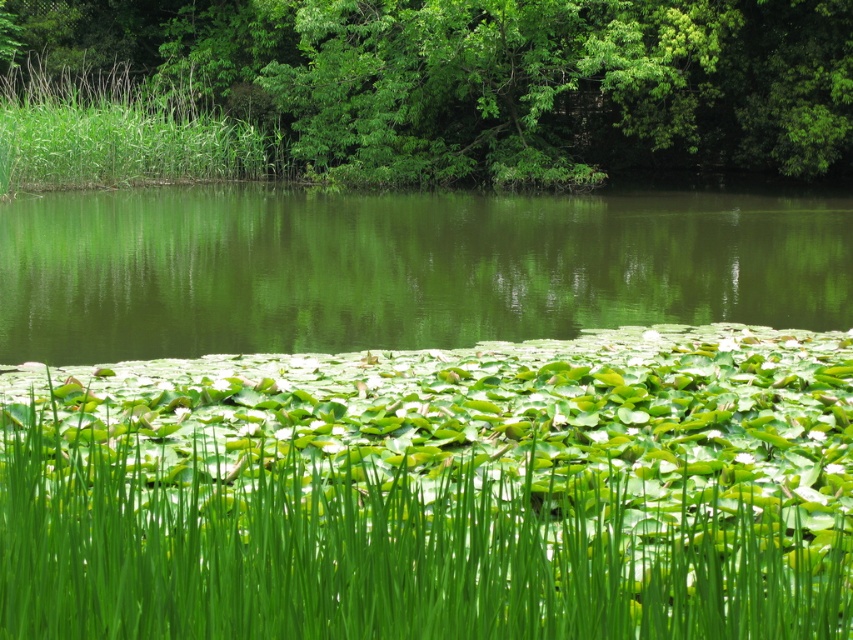
Question: Is green grass at bottom to the left of green smooth water at center from the viewer's perspective?

Choices:
 (A) no
 (B) yes

Answer: (A)

Question: Which object appears farthest from the camera in this image?

Choices:
 (A) green smooth water at center
 (B) green grass at bottom

Answer: (A)

Question: Which object is the farthest from the green leafy tree at upper center?

Choices:
 (A) green smooth water at center
 (B) green grass at bottom

Answer: (B)

Question: Is green grass at bottom positioned at the back of green leafy tree at upper center?

Choices:
 (A) no
 (B) yes

Answer: (A)

Question: Which object is closer to the camera taking this photo?

Choices:
 (A) green smooth water at center
 (B) green leafy tree at upper center

Answer: (A)

Question: Does green grass at bottom appear on the left side of green smooth water at center?

Choices:
 (A) no
 (B) yes

Answer: (A)